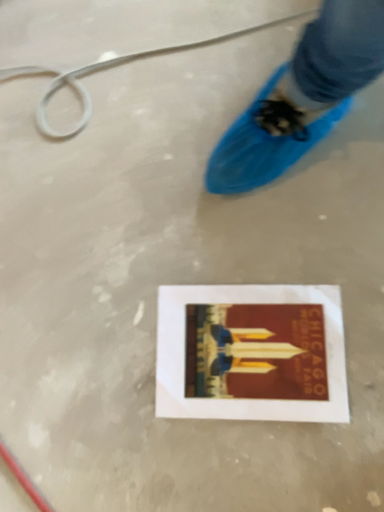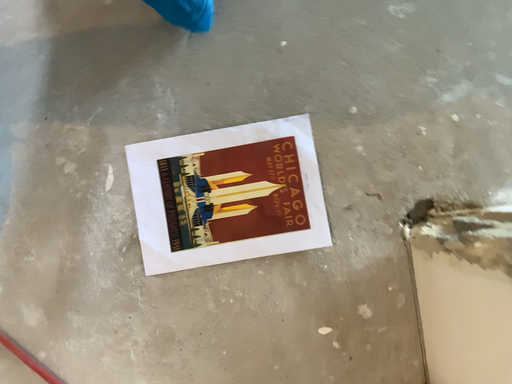
Question: How did the camera likely rotate when shooting the video?

Choices:
 (A) rotated downward
 (B) rotated upward

Answer: (A)